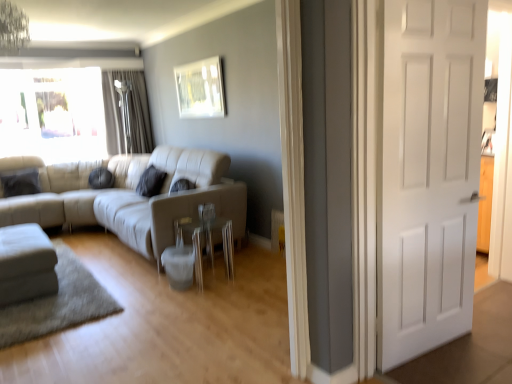
I want to click on vacant space underneath white matte door at right (from a real-world perspective), so click(x=423, y=350).